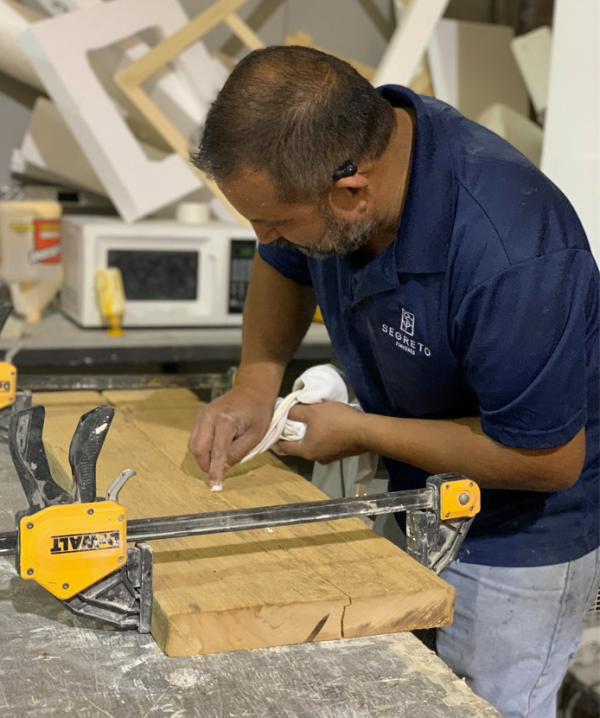
Locate an element on the screen. wooden block is located at coordinates (234, 584).